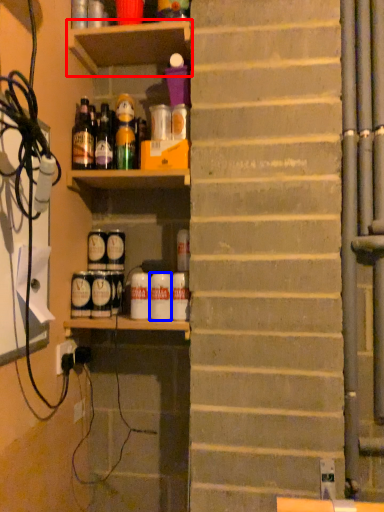
Question: Which object appears farthest to the camera in this image, shelf (highlighted by a red box) or beverage (highlighted by a blue box)?

Choices:
 (A) shelf
 (B) beverage

Answer: (B)